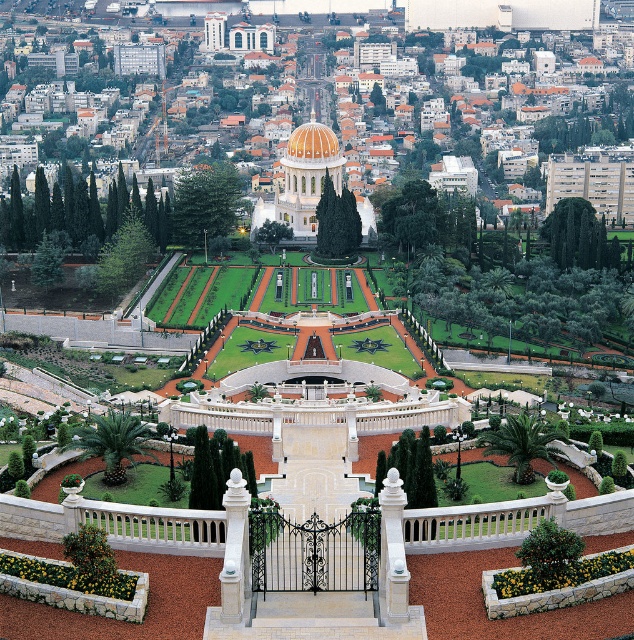
You are a visitor approaching the main entrance of the white stone pillar at center and the golden mosaic dome at center. Which object will you encounter first as you walk towards them?

The white stone pillar at center is in front of the golden mosaic dome at center, so you will encounter the white stone pillar at center first.

You are a tourist standing at the base of the grand staircase and want to take a photo of the golden mosaic dome at center without the white marble dome at center blocking it. Is this possible given their positions?

The golden mosaic dome at center is behind the white marble dome at center, so it will be blocked from view. You cannot take a photo of the golden mosaic dome at center without the white marble dome at center blocking it.

You are standing at the entrance of the grand staircase leading to the white building with a golden dome. From your current position, in which direction should you walk to reach the white stone pillar at center?

The white stone pillar at center is located at point (392, 552), so you should walk towards the center of the image to reach it.